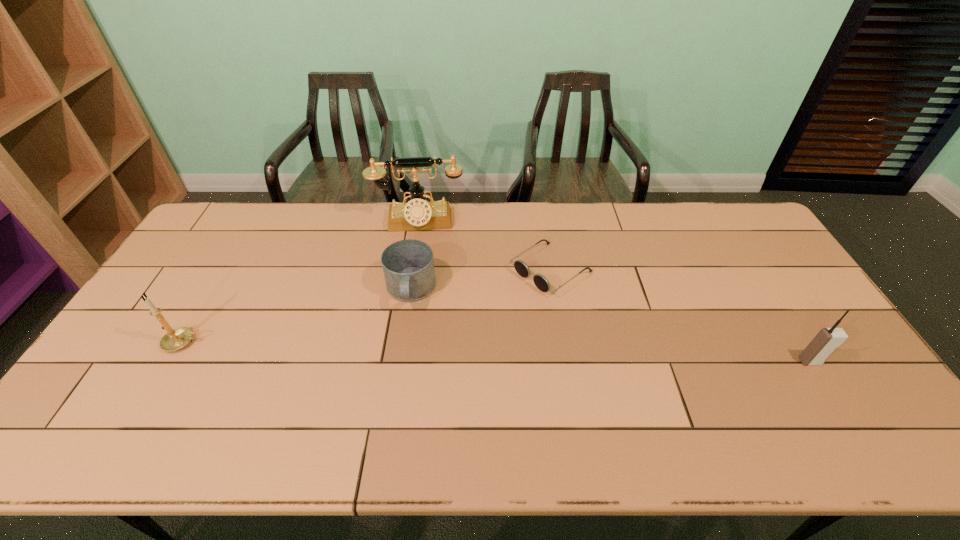
I want to click on the fourth farthest object, so click(x=175, y=339).

Identify the location of the leftmost object. The image size is (960, 540). (175, 339).

I want to click on cellular telephone, so click(x=824, y=343).

Where is `the rightmost object`? Image resolution: width=960 pixels, height=540 pixels. the rightmost object is located at coordinates (824, 343).

Find the location of a particular element. This screenshot has width=960, height=540. sunglasses is located at coordinates (540, 281).

You are a GUI agent. You are given a task and a screenshot of the screen. Output one action in this format:
    pyautogui.click(x=<x>, y=<y>)
    Task: Click on the shortest object
    This screenshot has width=960, height=540.
    Given the screenshot: What is the action you would take?
    pyautogui.click(x=540, y=281)

You are a GUI agent. You are given a task and a screenshot of the screen. Output one action in this format:
    pyautogui.click(x=<x>, y=<y>)
    Task: Click on the telephone
    
    Given the screenshot: What is the action you would take?
    pyautogui.click(x=418, y=214)

What are the coordinates of `the tallest object` in the screenshot? It's located at (418, 214).

This screenshot has height=540, width=960. Identify the location of mug. (408, 265).

Locate an element on the screen. This screenshot has width=960, height=540. blank area located on the handle side of the fourth farthest object is located at coordinates (329, 342).